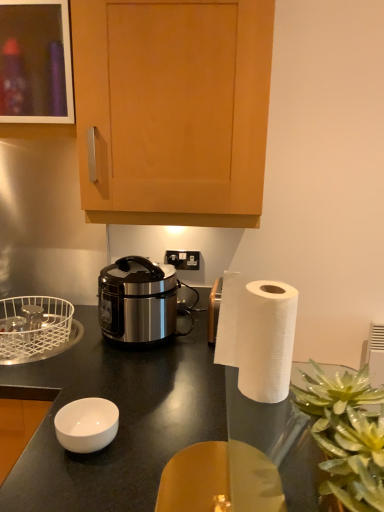
Question: From the image's perspective, would you say translucent glass vase at lower right is shown under white wire basket at left?

Choices:
 (A) yes
 (B) no

Answer: (A)

Question: Considering the relative sizes of translucent glass vase at lower right and white wire basket at left in the image provided, is translucent glass vase at lower right taller than white wire basket at left?

Choices:
 (A) no
 (B) yes

Answer: (B)

Question: From the image's perspective, is translucent glass vase at lower right above white wire basket at left?

Choices:
 (A) no
 (B) yes

Answer: (A)

Question: Does translucent glass vase at lower right appear on the left side of white wire basket at left?

Choices:
 (A) yes
 (B) no

Answer: (B)

Question: Can you confirm if translucent glass vase at lower right is bigger than white wire basket at left?

Choices:
 (A) no
 (B) yes

Answer: (A)

Question: Can you confirm if translucent glass vase at lower right is smaller than white wire basket at left?

Choices:
 (A) no
 (B) yes

Answer: (B)

Question: From a real-world perspective, is matte wood cabinet at upper left, the 2th cabinetry viewed from the right, on top of translucent glass vase at lower right?

Choices:
 (A) yes
 (B) no

Answer: (A)

Question: Is matte wood cabinet at upper left, the first cabinetry in the left-to-right sequence, to the right of translucent glass vase at lower right from the viewer's perspective?

Choices:
 (A) yes
 (B) no

Answer: (B)

Question: Is matte wood cabinet at upper left, the 2th cabinetry viewed from the right, wider than translucent glass vase at lower right?

Choices:
 (A) yes
 (B) no

Answer: (A)

Question: Can you confirm if matte wood cabinet at upper left, the 2th cabinetry viewed from the right, is thinner than translucent glass vase at lower right?

Choices:
 (A) yes
 (B) no

Answer: (B)

Question: Considering the relative sizes of matte wood cabinet at upper left, the 2th cabinetry viewed from the right, and translucent glass vase at lower right in the image provided, is matte wood cabinet at upper left, the 2th cabinetry viewed from the right, shorter than translucent glass vase at lower right?

Choices:
 (A) yes
 (B) no

Answer: (B)

Question: From the image's perspective, is matte wood cabinet at upper left, the first cabinetry in the left-to-right sequence, below translucent glass vase at lower right?

Choices:
 (A) no
 (B) yes

Answer: (A)

Question: Would you say stainless steel rice cooker at center is a long distance from black plastic power outlet at center?

Choices:
 (A) yes
 (B) no

Answer: (B)